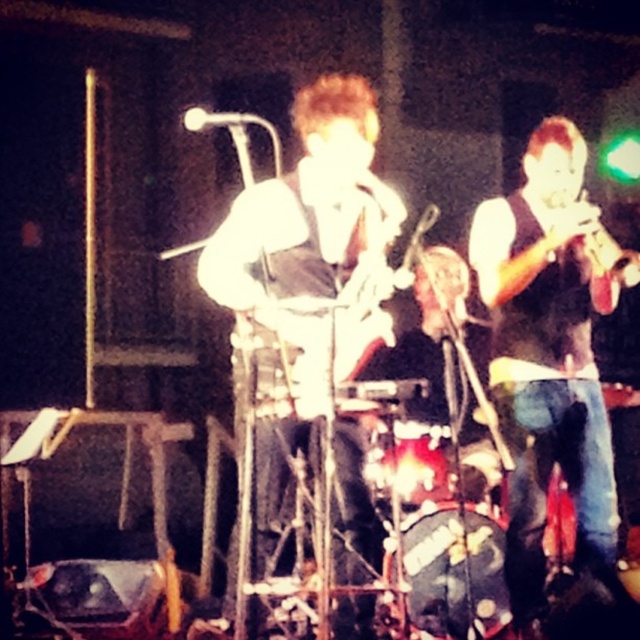
Does black matte vest at right have a smaller size compared to white matte guitar at center?

Incorrect, black matte vest at right is not smaller in size than white matte guitar at center.

What do you see at coordinates (552, 358) in the screenshot? I see `black matte vest at right` at bounding box center [552, 358].

At what (x,y) coordinates should I click in order to perform the action: click on black matte vest at right. Please return your answer as a coordinate pair (x, y). The height and width of the screenshot is (640, 640). Looking at the image, I should click on (552, 358).

Is black matte vest at right to the left of metallic brass trumpet at upper right from the viewer's perspective?

Yes, black matte vest at right is to the left of metallic brass trumpet at upper right.

Between point (596, 493) and point (604, 230), which one is positioned behind?

Positioned behind is point (596, 493).

Find the location of `black matte vest at right`. black matte vest at right is located at coordinates (552, 358).

Can you confirm if white matte guitar at center is positioned to the left of metallic brass trumpet at upper right?

Yes, white matte guitar at center is to the left of metallic brass trumpet at upper right.

Can you confirm if white matte guitar at center is taller than metallic brass trumpet at upper right?

Correct, white matte guitar at center is much taller as metallic brass trumpet at upper right.

The image size is (640, 640). What do you see at coordinates (316, 243) in the screenshot?
I see `white matte guitar at center` at bounding box center [316, 243].

Locate an element on the screen. Image resolution: width=640 pixels, height=640 pixels. white matte guitar at center is located at coordinates (316, 243).